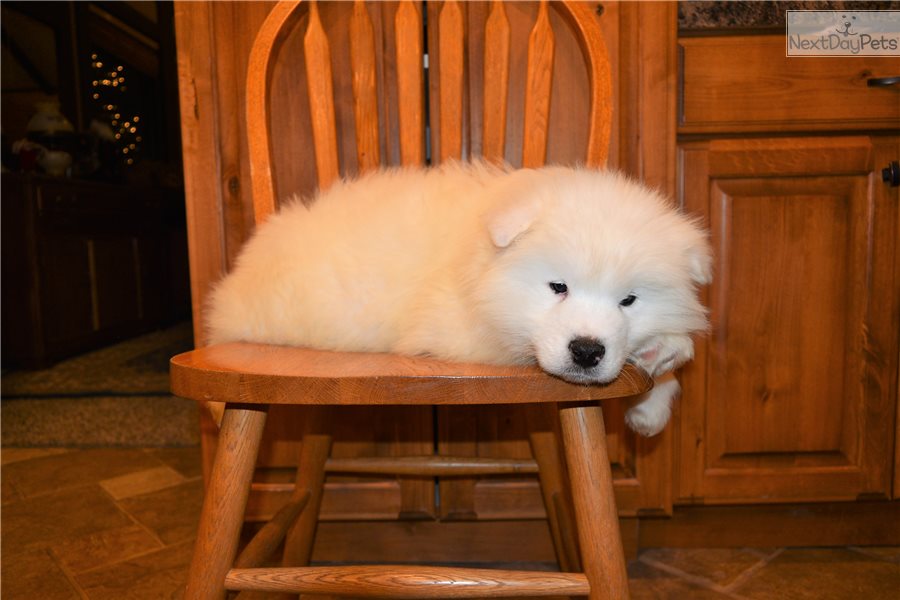
You are a GUI agent. You are given a task and a screenshot of the screen. Output one action in this format:
    pyautogui.click(x=<x>, y=<y>)
    Task: Click on the light place in floor
    
    Given the screenshot: What is the action you would take?
    pyautogui.click(x=127, y=481)